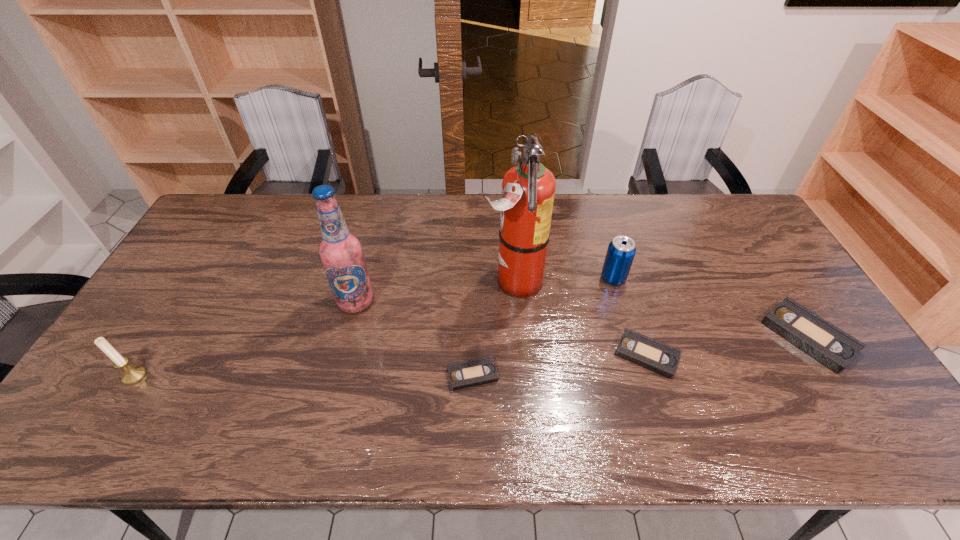
The height and width of the screenshot is (540, 960). Identify the location of the sixth shortest object. (341, 253).

Find the location of a particular element. This screenshot has width=960, height=540. free location located on the right of the shortest videotape is located at coordinates click(597, 375).

You are a GUI agent. You are given a task and a screenshot of the screen. Output one action in this format:
    pyautogui.click(x=<x>, y=<y>)
    Task: Click on the vacant space located on the left of the sixth tallest object
    The width and height of the screenshot is (960, 540).
    Given the screenshot: What is the action you would take?
    pyautogui.click(x=550, y=355)

You are a GUI agent. You are given a task and a screenshot of the screen. Output one action in this format:
    pyautogui.click(x=<x>, y=<y>)
    Task: Click on the vacant area situated 0.300m on the back of the rightmost object
    The image size is (960, 540).
    Given the screenshot: What is the action you would take?
    pyautogui.click(x=745, y=236)

At what (x,y) coordinates should I click in order to perform the action: click on free space located 0.250m from the nozzle of the tallest object. Please return your answer as a coordinate pair (x, y). Looking at the image, I should click on (400, 281).

The width and height of the screenshot is (960, 540). Identify the location of free space located 0.330m from the nozzle of the tallest object. (374, 281).

The image size is (960, 540). I want to click on vacant space situated from the nozzle of the tallest object, so click(x=467, y=281).

Locate an element on the screen. free space located 0.260m on the right of the pop soda is located at coordinates (710, 279).

Image resolution: width=960 pixels, height=540 pixels. What are the coordinates of `vacant area situated 0.100m on the back of the leftmost object` in the screenshot? It's located at [x=160, y=335].

The width and height of the screenshot is (960, 540). What are the coordinates of `blank space located 0.120m on the front of the alcohol` in the screenshot? It's located at (x=343, y=353).